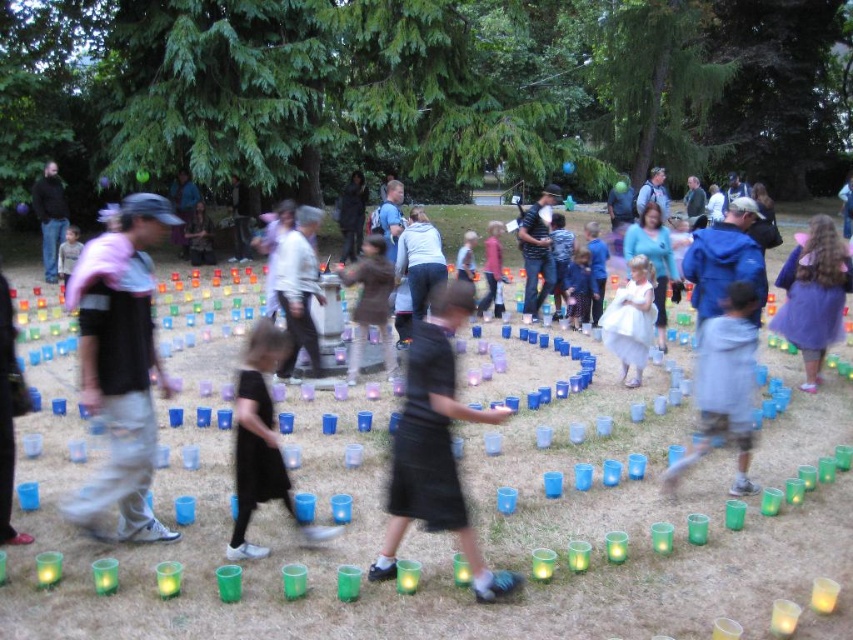
Where is `light gray distressed jeans at left`? The width and height of the screenshot is (853, 640). light gray distressed jeans at left is located at coordinates (120, 365).

Identify the location of light gray distressed jeans at left. (120, 365).